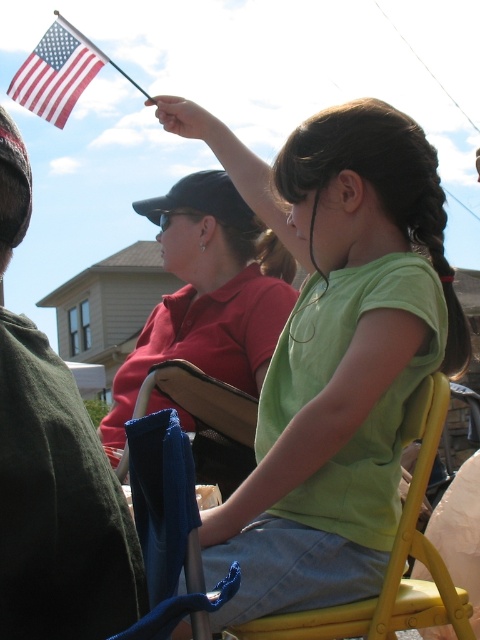
Between green matte shirt at center and red-white-blue fabric flag at upper left, which one appears on the right side from the viewer's perspective?

Positioned to the right is green matte shirt at center.

Does green matte shirt at center appear on the left side of red-white-blue fabric flag at upper left?

Incorrect, green matte shirt at center is not on the left side of red-white-blue fabric flag at upper left.

In the scene shown: Who is more forward, [301,449] or [56,56]?

Point [301,449] is more forward.

The height and width of the screenshot is (640, 480). What are the coordinates of `green matte shirt at center` in the screenshot? It's located at (336, 324).

Can you confirm if green matte shirt at center is positioned to the right of dark green fabric at left?

Yes, green matte shirt at center is to the right of dark green fabric at left.

Is point (259, 205) positioned before point (2, 177)?

No, (259, 205) is behind (2, 177).

This screenshot has height=640, width=480. Identify the location of green matte shirt at center. (336, 324).

From the picture: Is yellow plastic chair at center in front of red-white-blue fabric flag at upper left?

Yes, yellow plastic chair at center is in front of red-white-blue fabric flag at upper left.

Between yellow plastic chair at center and red-white-blue fabric flag at upper left, which one is positioned higher?

red-white-blue fabric flag at upper left is above.

Identify the location of yellow plastic chair at center. (392, 557).